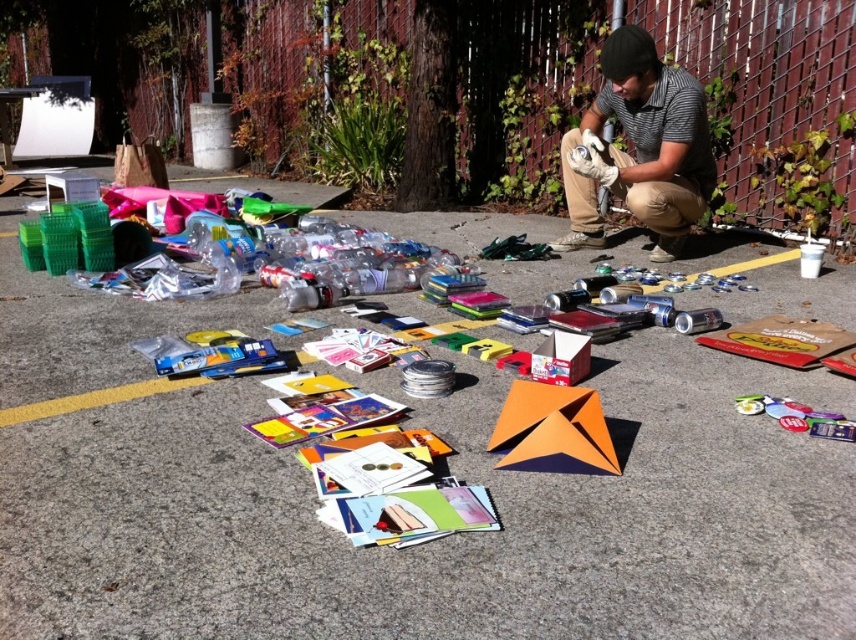
You are helping someone organize items on the ground. You see the orange paper airplane at center and the gray striped shirt at center. Which item is located to the left?

The orange paper airplane at center is to the left of the gray striped shirt at center.

From the picture: You are a delivery person who needs to pick up a package from the scene. You see the orange paper airplane at center and the gray striped shirt at center. Which object is closer to you?

The orange paper airplane at center is closer to the viewer than the gray striped shirt at center, so the orange paper airplane at center is closer to you.